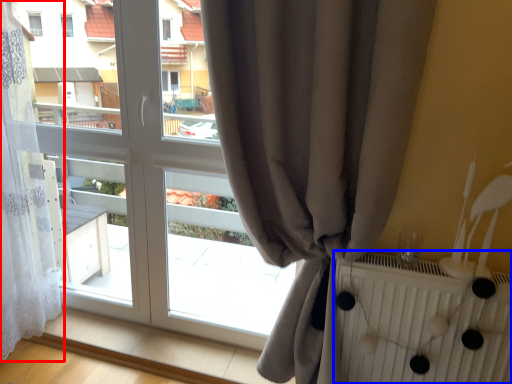
Question: Which of the following is the farthest to the observer, curtain (highlighted by a red box) or radiator (highlighted by a blue box)?

Choices:
 (A) curtain
 (B) radiator

Answer: (A)